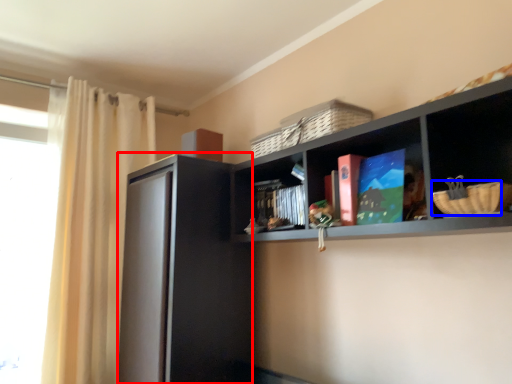
Question: Which object appears closest to the camera in this image, screen door (highlighted by a red box) or basket (highlighted by a blue box)?

Choices:
 (A) screen door
 (B) basket

Answer: (B)